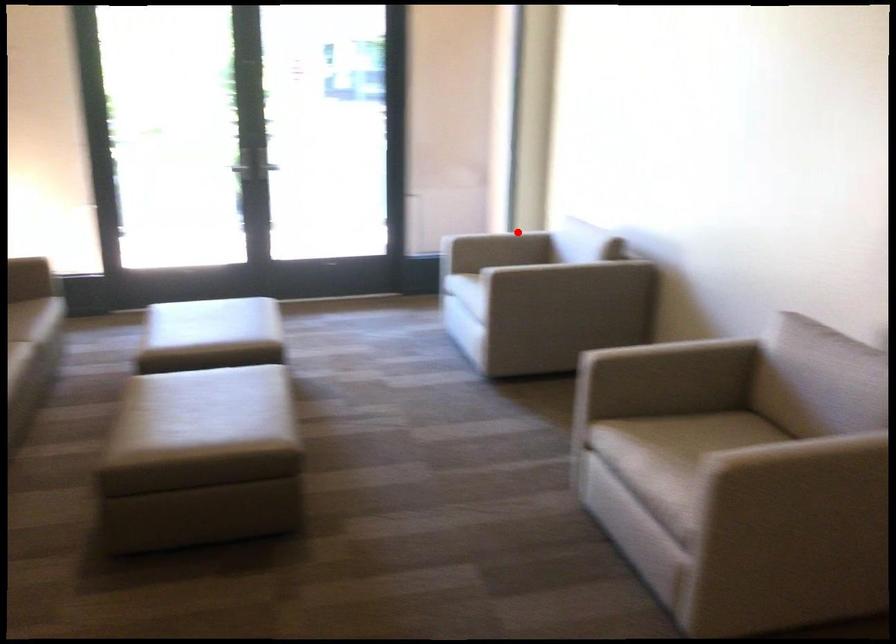
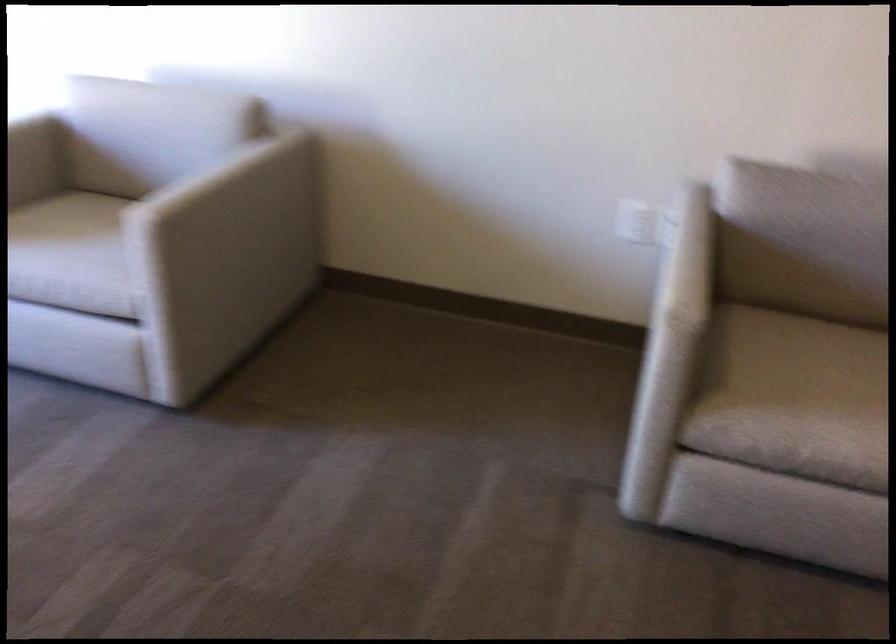
Question: I am providing you with two images of the same scene from different viewpoints. Image1 has a red point marked. In image2, the corresponding 3D location appears at what relative position? Reply with the corresponding letter.

Choices:
 (A) Closer
 (B) Farther

Answer: (A)